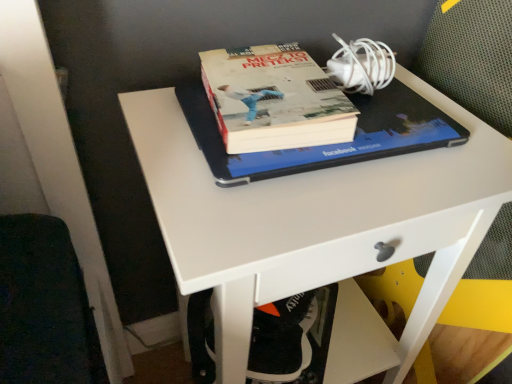
Locate an element on the screen. The image size is (512, 384). empty space that is to the right of hardcover book at center is located at coordinates (444, 148).